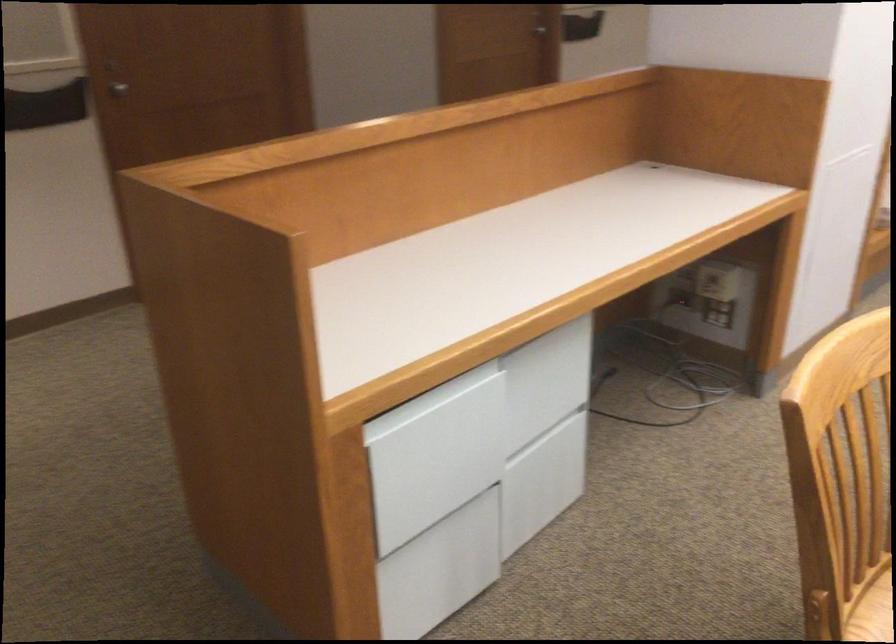
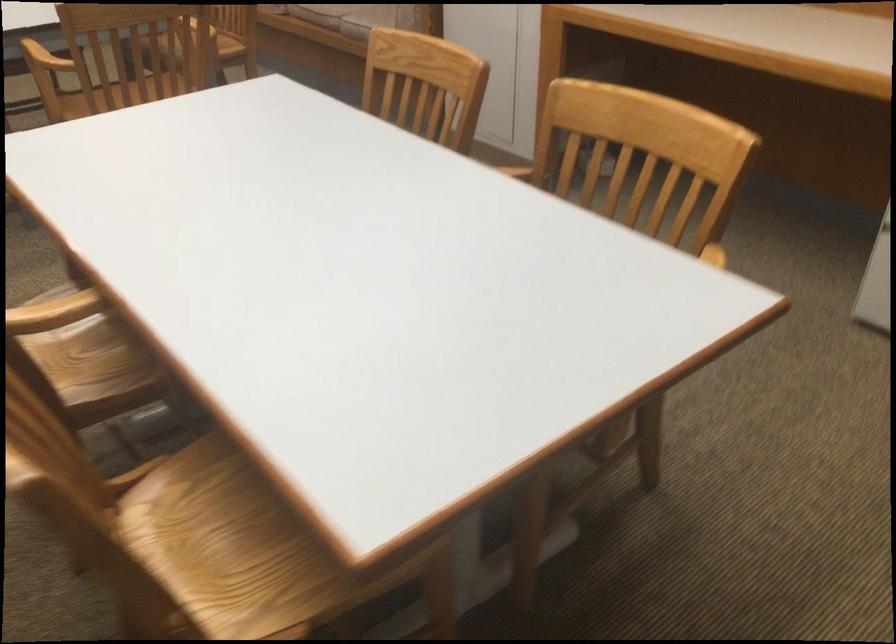
Based on the continuous images, in which direction is the camera rotating?

The camera's rotation is toward right-down.